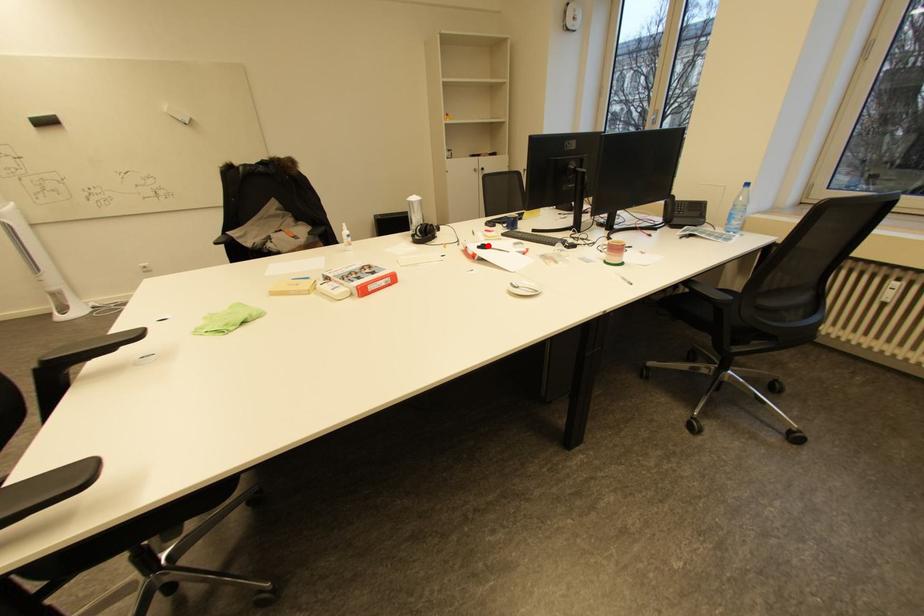
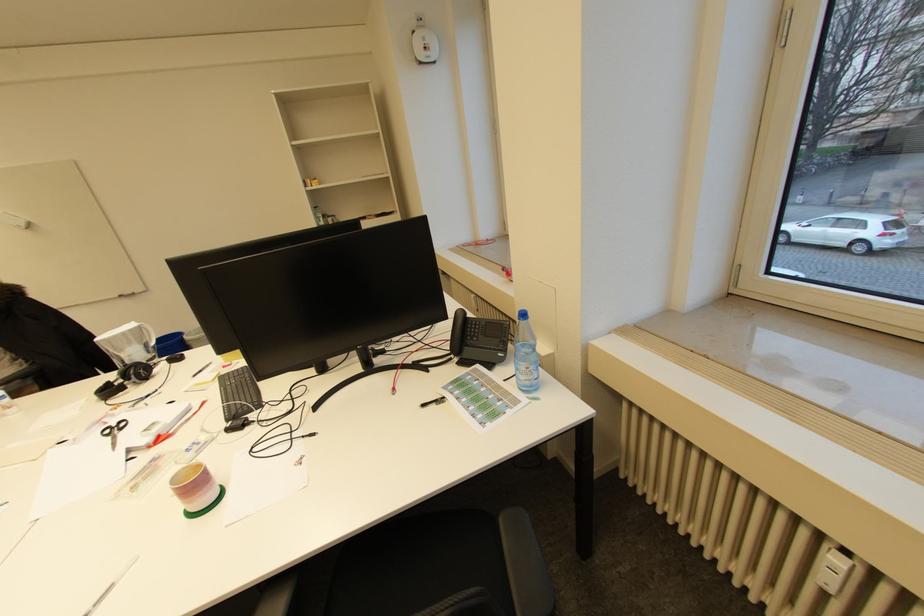
Where in the second image is the point corresponding to the highlighted location from the first image?

(127, 422)